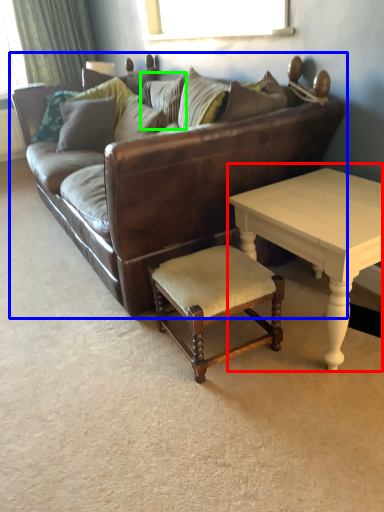
Question: Based on their relative distances, which object is farther from coffee table (highlighted by a red box)? Choose from studio couch (highlighted by a blue box) and pillow (highlighted by a green box).

Choices:
 (A) studio couch
 (B) pillow

Answer: (B)